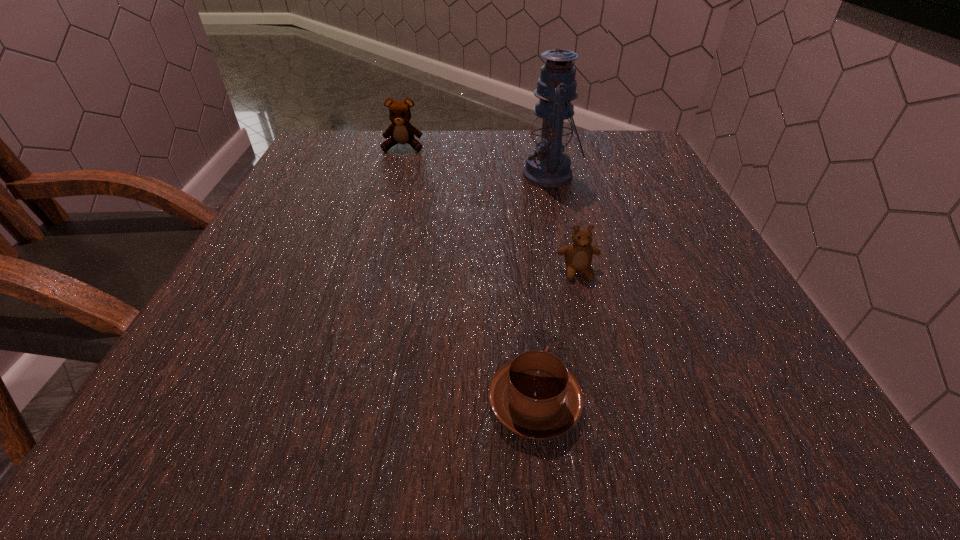
Image resolution: width=960 pixels, height=540 pixels. I want to click on lantern, so click(548, 167).

The image size is (960, 540). Find the location of `the third nearest object`. the third nearest object is located at coordinates (548, 167).

Identify the location of the taller teddy bear. (401, 131).

Find the location of a particular element. Image resolution: width=960 pixels, height=540 pixels. the farther teddy bear is located at coordinates (401, 131).

I want to click on the nearer teddy bear, so click(578, 255).

Identify the location of the right teddy bear. This screenshot has width=960, height=540. coord(578,255).

Identify the location of the nearest object. (535, 396).

Where is `the shortest object`? This screenshot has width=960, height=540. the shortest object is located at coordinates (535, 396).

You are a GUI agent. You are given a task and a screenshot of the screen. Output one action in this format:
    pyautogui.click(x=<x>, y=<y>)
    Task: Click on the vacant space located 0.160m on the front-facing side of the tallest object
    The image size is (960, 540).
    Given the screenshot: What is the action you would take?
    pyautogui.click(x=449, y=175)

Image resolution: width=960 pixels, height=540 pixels. I want to click on free space located on the front-facing side of the tallest object, so click(440, 175).